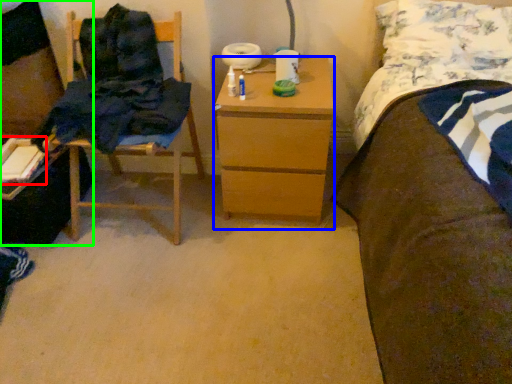
Question: Based on their relative distances, which object is farther from book (highlighted by a red box)? Choose from nightstand (highlighted by a blue box) and desk (highlighted by a green box).

Choices:
 (A) nightstand
 (B) desk

Answer: (A)